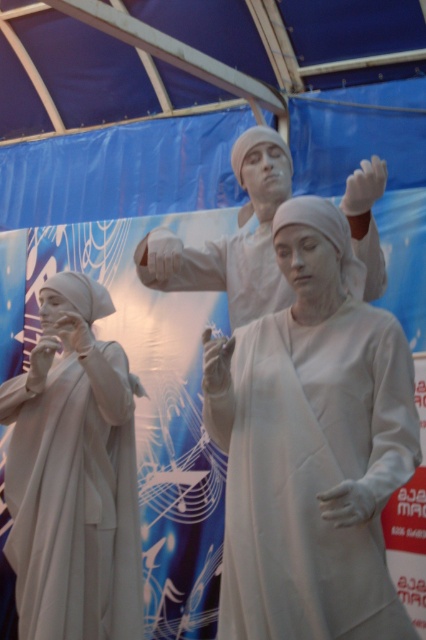
You are an art curator planning to display the white matte statue at left and the matte white statue at center in a gallery. Given their sizes, which statue requires a wider base to prevent tipping over?

The matte white statue at center requires a wider base because it is wider than the white matte statue at left, making it more prone to tipping over without proper support.

You are an art curator examining the image. You notice the white matte robe at center and the matte white statue at center. Which object is positioned lower in the image?

The white matte robe at center is located below the matte white statue at center, so the white matte robe at center is positioned lower in the image.

You are an art curator planning to install a spotlight on the white matte robe at center. According to the coordinates provided, where should you position the spotlight to ensure it directly illuminates the robe?

The white matte robe at center is located at point (310, 468), so the spotlight should be positioned to focus on those coordinates to illuminate it directly.